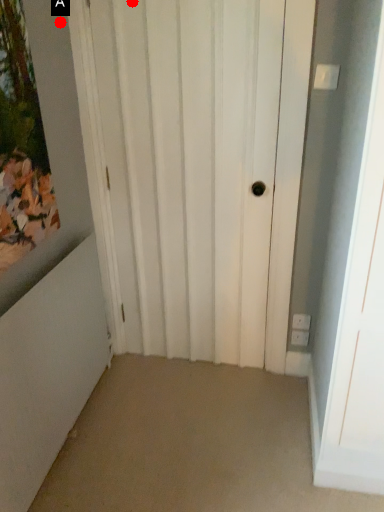
Question: Two points are circled on the image, labeled by A and B beside each circle. Which point is farther from the camera taking this photo?

Choices:
 (A) A is further
 (B) B is further

Answer: (A)